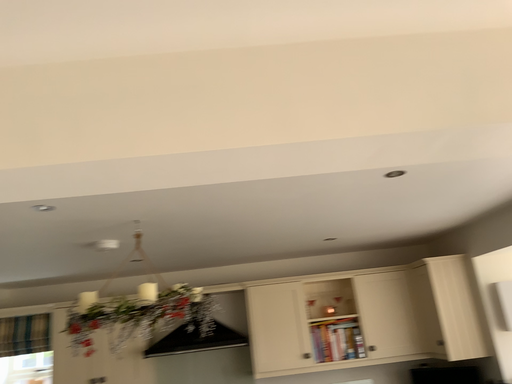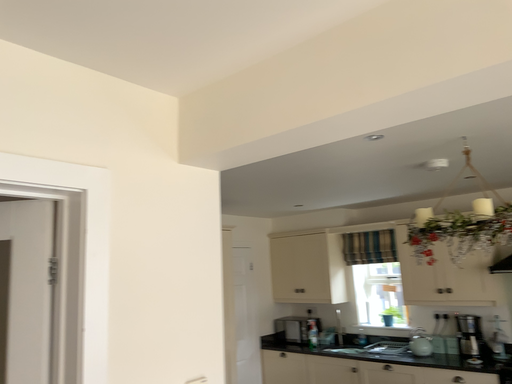
Question: Which way did the camera rotate in the video?

Choices:
 (A) rotated upward
 (B) rotated downward

Answer: (B)